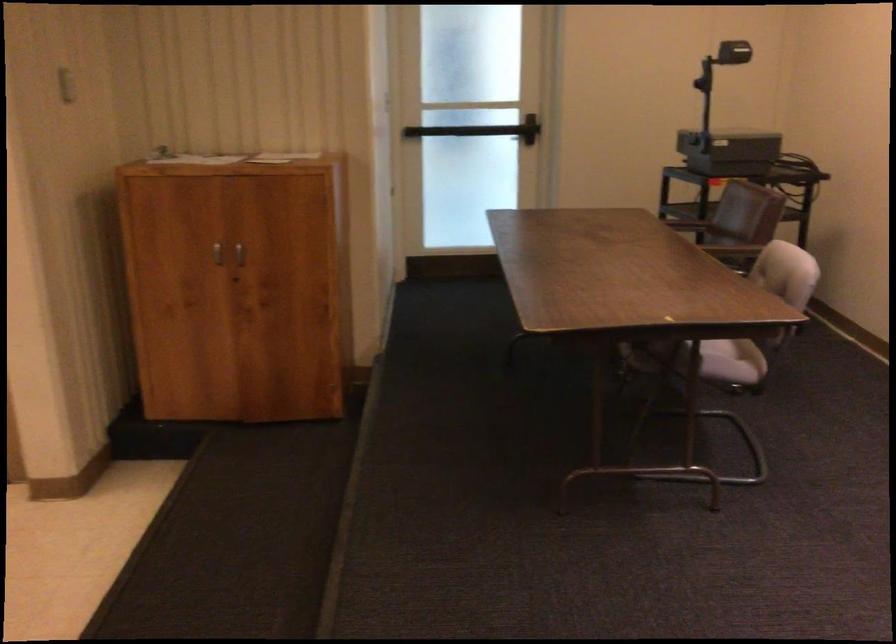
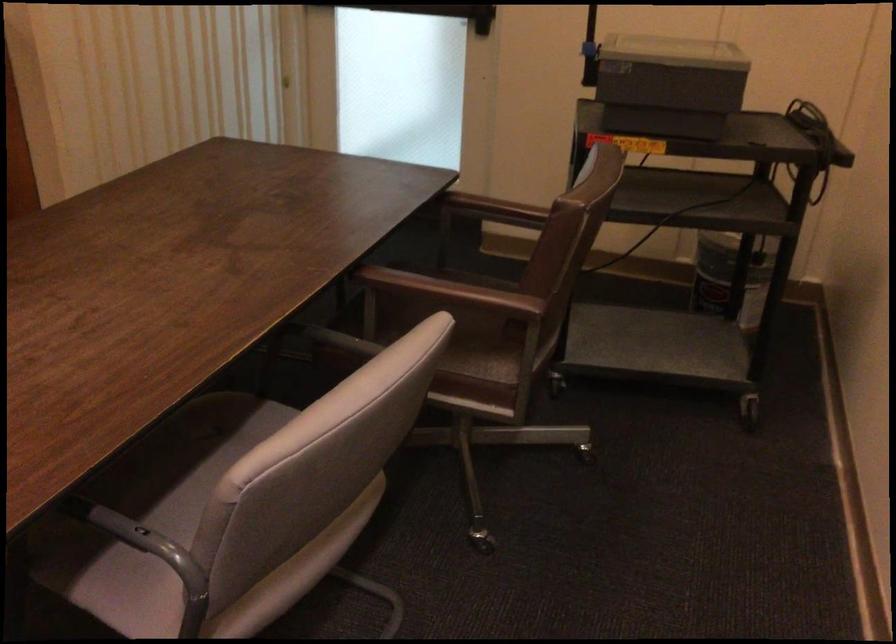
The point at (737, 149) is marked in the first image. Where is the corresponding point in the second image?

(668, 84)